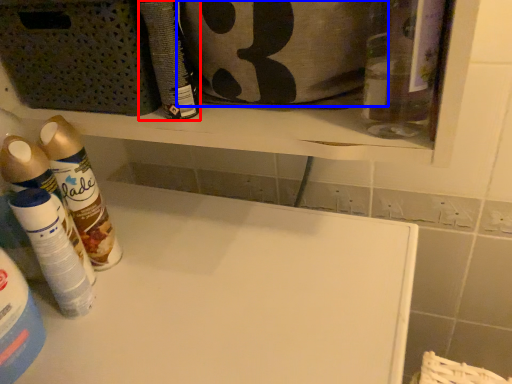
Question: Which object is closer to the camera taking this photo, cleaning product (highlighted by a red box) or pouch (highlighted by a blue box)?

Choices:
 (A) cleaning product
 (B) pouch

Answer: (B)